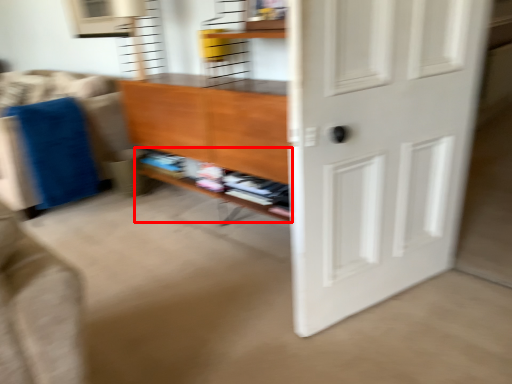
Question: Where is shelf (annotated by the red box) located in relation to door in the image?

Choices:
 (A) left
 (B) right

Answer: (A)